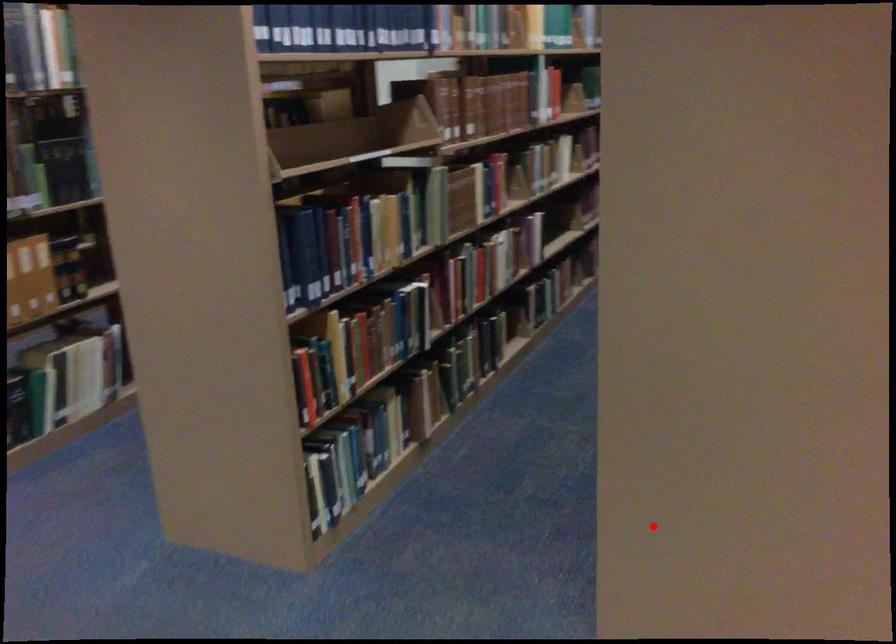
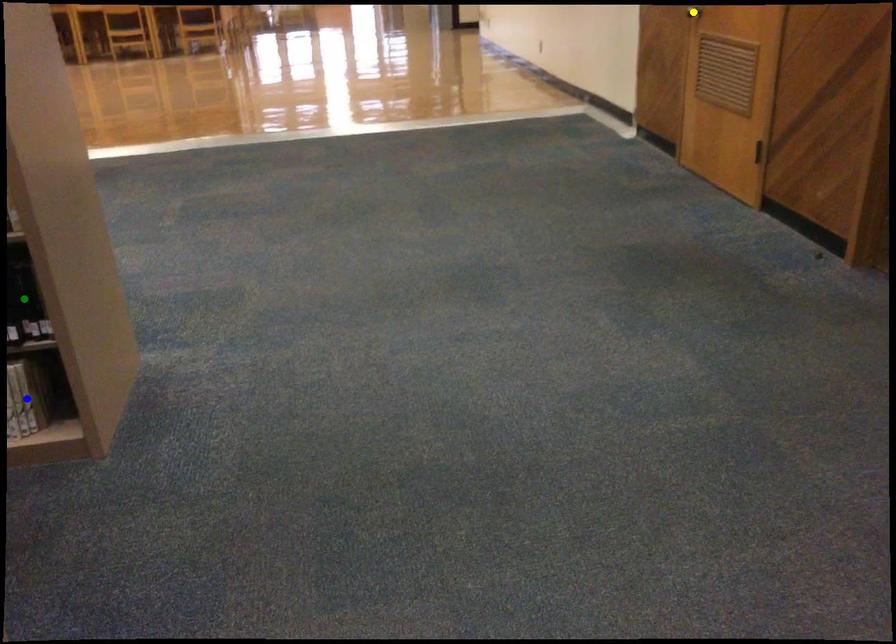
Question: I am providing you with two images of the same scene from different viewpoints. A red point is marked on the first image. You are given multiple points on the second image. Which point in image 2 is actually the same real-world point as the red point in image 1?

Choices:
 (A) yellow point
 (B) green point
 (C) blue point

Answer: (C)